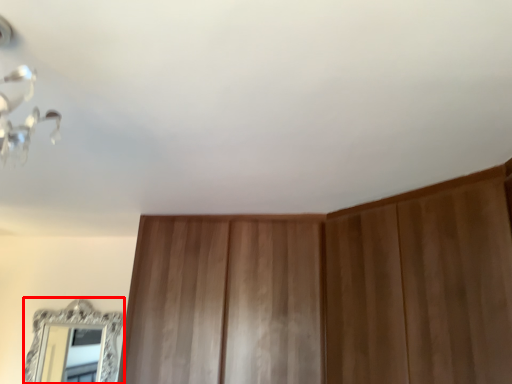
Question: From the image's perspective, considering the relative positions of mirror (annotated by the red box) and dresser in the image provided, where is mirror (annotated by the red box) located with respect to the staircase?

Choices:
 (A) above
 (B) below

Answer: (B)